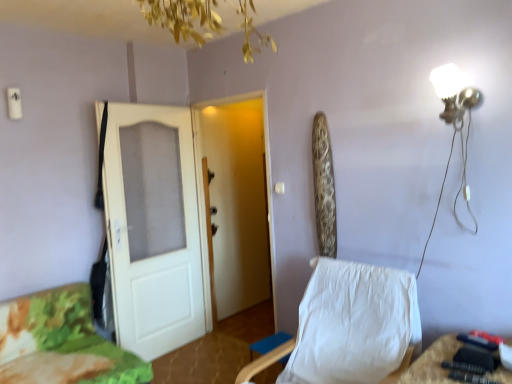
Where is `vacant space that is to the left of white wooden door at center, the 1th door positioned from the right`? Image resolution: width=512 pixels, height=384 pixels. vacant space that is to the left of white wooden door at center, the 1th door positioned from the right is located at coordinates (197, 352).